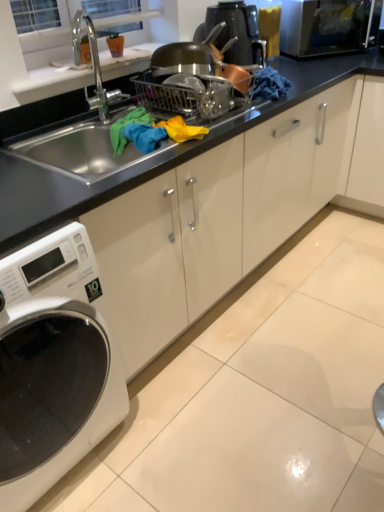
Question: From the image's perspective, would you say black glossy coffee machine at upper center is positioned over black matte sink at center?

Choices:
 (A) yes
 (B) no

Answer: (A)

Question: Is black glossy coffee machine at upper center smaller than black matte sink at center?

Choices:
 (A) no
 (B) yes

Answer: (B)

Question: Is black glossy coffee machine at upper center in contact with black matte sink at center?

Choices:
 (A) yes
 (B) no

Answer: (B)

Question: From a real-world perspective, is black glossy coffee machine at upper center on black matte sink at center?

Choices:
 (A) yes
 (B) no

Answer: (A)

Question: Can you confirm if black glossy coffee machine at upper center is shorter than black matte sink at center?

Choices:
 (A) no
 (B) yes

Answer: (B)

Question: Does black glossy coffee machine at upper center have a greater width compared to black matte sink at center?

Choices:
 (A) no
 (B) yes

Answer: (A)

Question: Considering the relative positions of black matte sink at center and black glossy coffee machine at upper center in the image provided, is black matte sink at center to the right of black glossy coffee machine at upper center from the viewer's perspective?

Choices:
 (A) no
 (B) yes

Answer: (A)

Question: Considering the relative sizes of black matte sink at center and black glossy coffee machine at upper center in the image provided, is black matte sink at center shorter than black glossy coffee machine at upper center?

Choices:
 (A) no
 (B) yes

Answer: (A)

Question: From a real-world perspective, is black matte sink at center beneath black glossy coffee machine at upper center?

Choices:
 (A) yes
 (B) no

Answer: (A)

Question: Is black matte sink at center completely or partially outside of black glossy coffee machine at upper center?

Choices:
 (A) no
 (B) yes

Answer: (B)

Question: Is black matte sink at center aimed at black glossy coffee machine at upper center?

Choices:
 (A) no
 (B) yes

Answer: (A)

Question: Is black matte sink at center thinner than black glossy coffee machine at upper center?

Choices:
 (A) yes
 (B) no

Answer: (B)

Question: Considering the relative sizes of white glossy washing machine at lower left and black matte sink at center in the image provided, is white glossy washing machine at lower left taller than black matte sink at center?

Choices:
 (A) no
 (B) yes

Answer: (B)